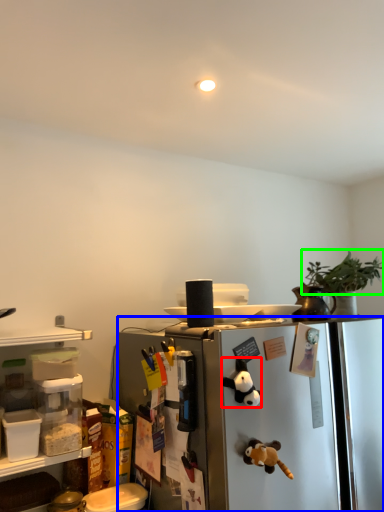
Question: Considering the real-world distances, which object is farthest from toy (highlighted by a red box)? refrigerator (highlighted by a blue box) or plant (highlighted by a green box)?

Choices:
 (A) refrigerator
 (B) plant

Answer: (B)